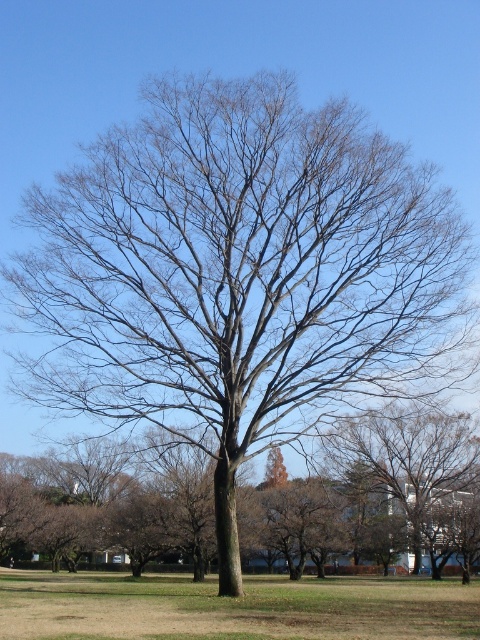
You are standing at the origin point in the image. You want to walk to the green grass at center. What direction should you walk in?

Since the green grass at center is located at point 0.950 on the x axis and 0.485 on the y axis, you should walk towards the right direction from your current position at the origin.

Looking at this image, you are a gardener trying to mow the green grass at center and trim the bare branches at center. Which area requires a wider equipment path to handle?

The green grass at center requires a wider equipment path because its width surpasses that of the bare branches at center.